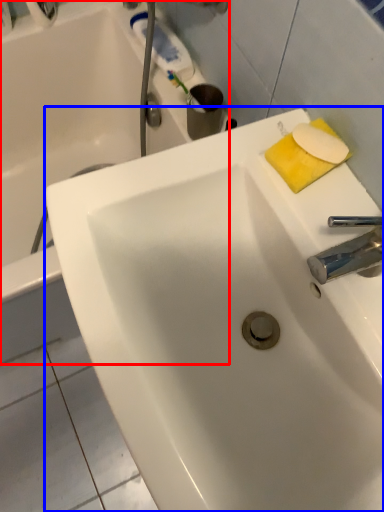
Question: Which object appears farthest to the camera in this image, bathtub (highlighted by a red box) or sink (highlighted by a blue box)?

Choices:
 (A) bathtub
 (B) sink

Answer: (A)